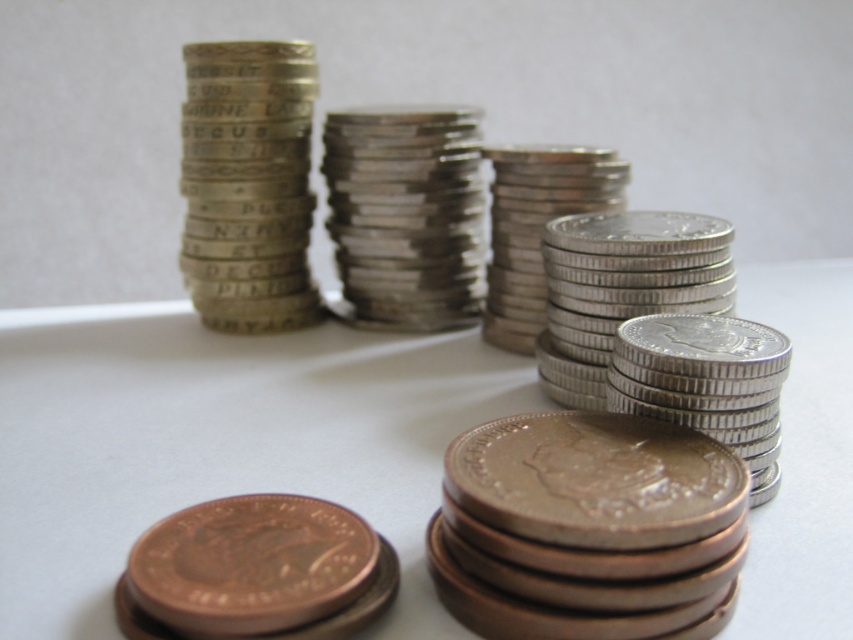
Question: Which of the following is the closest to the observer?

Choices:
 (A) (828, 461)
 (B) (392, 115)
 (C) (151, 577)
 (D) (726, 573)

Answer: (C)

Question: Which object is closer to the camera taking this photo?

Choices:
 (A) silver metallic coins at center
 (B) silver metallic coin at center
 (C) copper-bronze coin at lower left

Answer: (C)

Question: Which point is closer to the camera?

Choices:
 (A) copper-bronze coin at lower left
 (B) silver metallic coin at center
 (C) silver metallic coins at center

Answer: (A)

Question: Does bronze metallic coin at lower center have a lesser width compared to copper-bronze coin at lower left?

Choices:
 (A) no
 (B) yes

Answer: (A)

Question: Is bronze metallic coin at lower center above silver metallic coin at center?

Choices:
 (A) no
 (B) yes

Answer: (A)

Question: Is bronze metallic coin at lower center thinner than silver metallic coins at center?

Choices:
 (A) yes
 (B) no

Answer: (B)